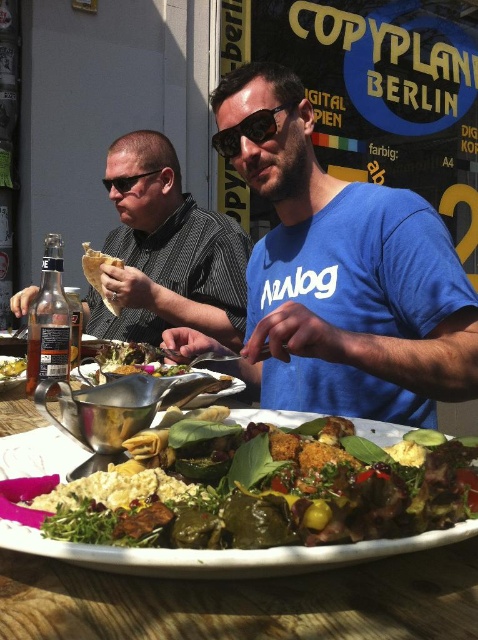
Question: Is matte black shirt at left thinner than matte white plate at center?

Choices:
 (A) yes
 (B) no

Answer: (B)

Question: Can you confirm if matte white plate at center is wider than black plastic sunglasses at center?

Choices:
 (A) no
 (B) yes

Answer: (B)

Question: Is matte white plate at center below black plastic sunglasses at center?

Choices:
 (A) yes
 (B) no

Answer: (A)

Question: Which point appears farthest from the camera in this image?

Choices:
 (A) (10, 365)
 (B) (216, 140)
 (C) (380, 330)

Answer: (B)

Question: Which of the following is the farthest from the observer?

Choices:
 (A) (232, 321)
 (B) (412, 538)
 (C) (150, 173)

Answer: (C)

Question: Which object is farther from the camera taking this photo?

Choices:
 (A) matte white plate at center
 (B) black plastic goggles at left
 (C) blue cotton shirt at center
 (D) black plastic sunglasses at center

Answer: (B)